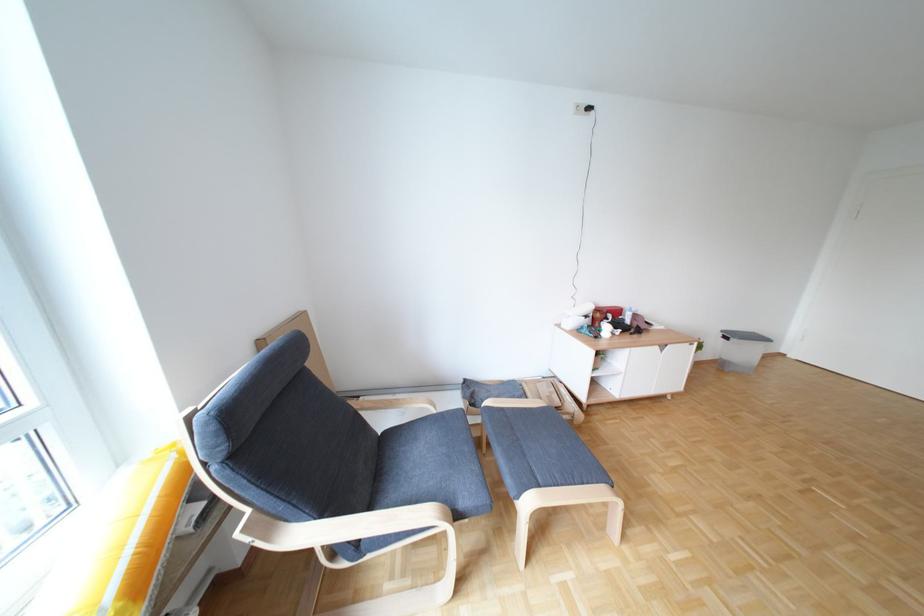
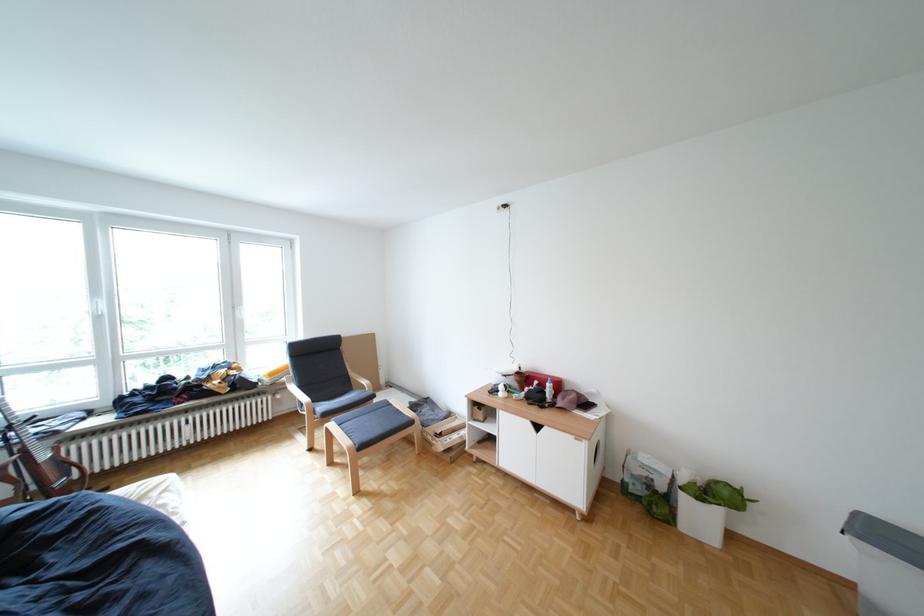
In the second image, find the point that corresponds to pixel 625 315 in the first image.

(552, 383)